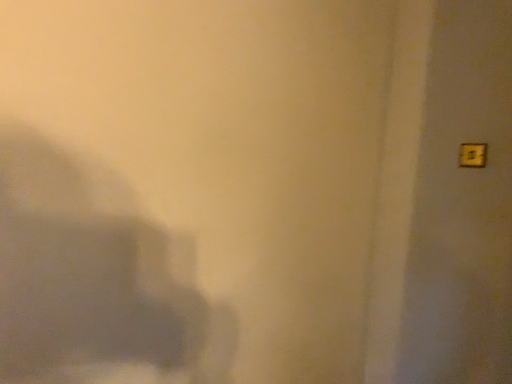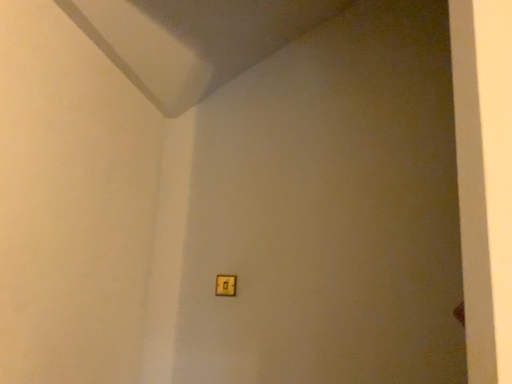
Question: Which way did the camera rotate in the video?

Choices:
 (A) rotated right
 (B) rotated left

Answer: (A)